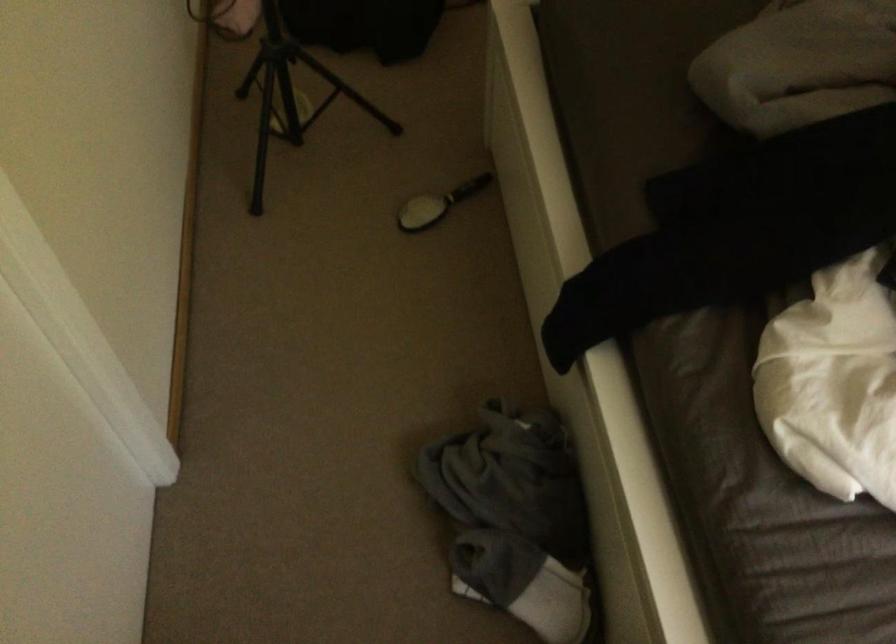
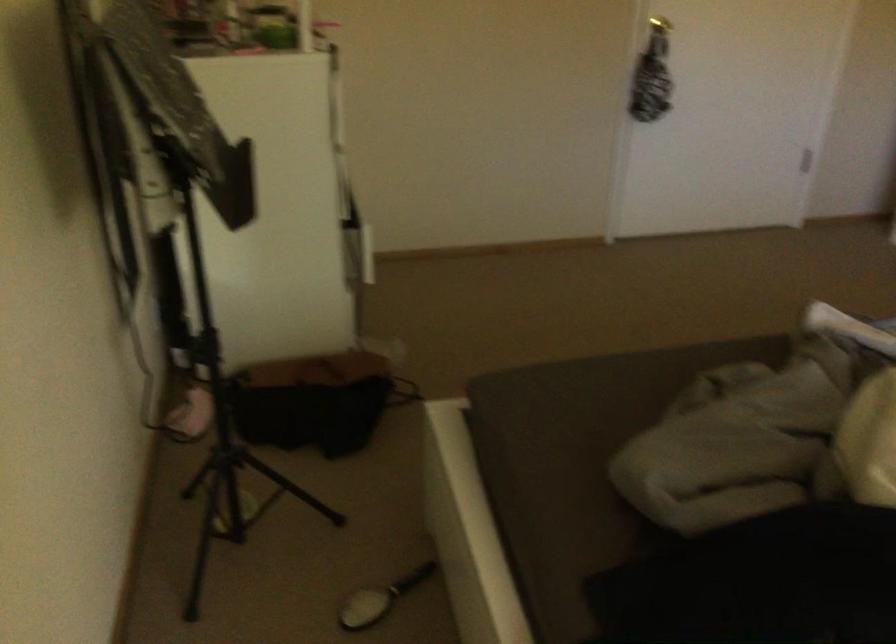
Question: I am providing you with two images of the same scene from different viewpoints. Please identify which objects are invisible in image2.

Choices:
 (A) metal container
 (B) hairbrush on floor
 (C) gold door knob
 (D) black tripod

Answer: (D)